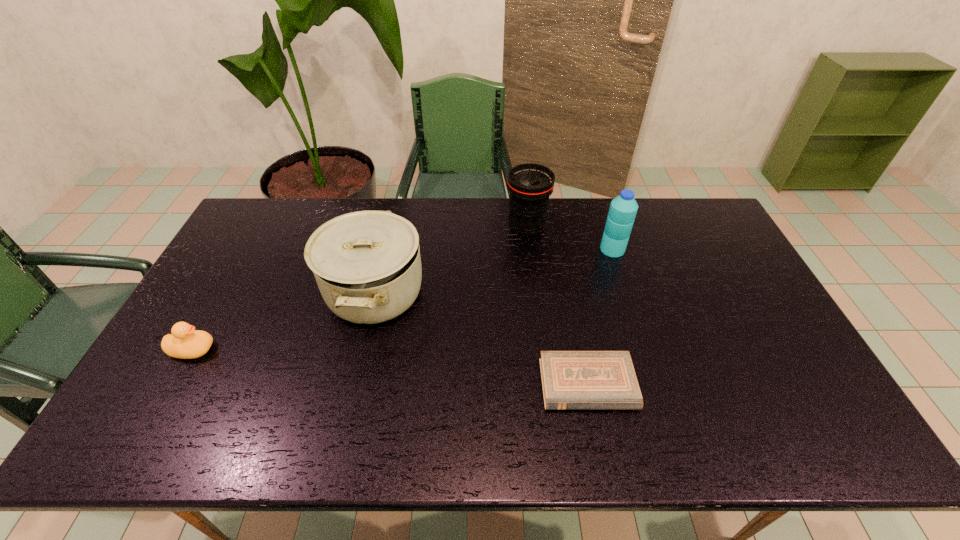
Image resolution: width=960 pixels, height=540 pixels. Find the location of `object that is at the far edge`. object that is at the far edge is located at coordinates (530, 185).

The image size is (960, 540). I want to click on object present at the left edge, so click(185, 342).

Identify the location of vacant space at the far edge of the desktop. Image resolution: width=960 pixels, height=540 pixels. (387, 204).

Identify the location of free space at the right edge of the desktop. (804, 365).

Where is `free space at the far left corner`? free space at the far left corner is located at coordinates (280, 218).

This screenshot has width=960, height=540. In order to click on vacant area at the near left corner in this screenshot , I will do `click(128, 437)`.

The height and width of the screenshot is (540, 960). In the image, there is a desktop. Find the location of `vacant space at the far right corner`. vacant space at the far right corner is located at coordinates (690, 205).

Find the location of a particular element. This screenshot has height=540, width=960. vacant area between the fourth object from right to left and the water bottle is located at coordinates (493, 271).

At what (x,y) coordinates should I click in order to perform the action: click on free area in between the duck and the Bible. Please return your answer as a coordinate pair (x, y). The width and height of the screenshot is (960, 540). Looking at the image, I should click on (390, 367).

The height and width of the screenshot is (540, 960). I want to click on free space that is in between the shortest object and the second shortest object, so click(x=390, y=367).